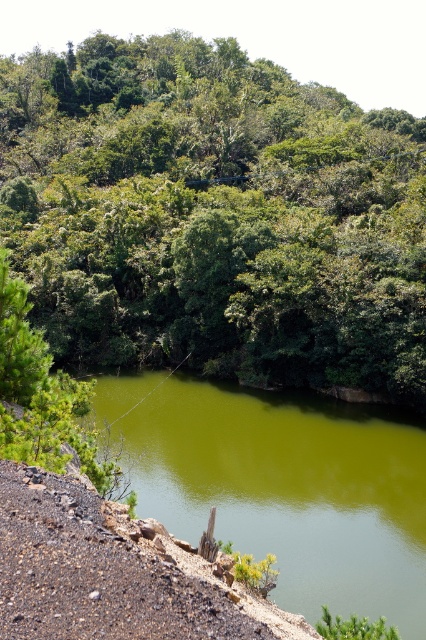
Is green leafy tree at upper center to the right of green smooth water at center from the viewer's perspective?

No, green leafy tree at upper center is not to the right of green smooth water at center.

Between green leafy tree at upper center and green smooth water at center, which one is positioned lower?

green smooth water at center is lower down.

Is point (222, 269) behind point (149, 403)?

Yes, it is behind point (149, 403).

Identify the location of green leafy tree at upper center. The width and height of the screenshot is (426, 640). (213, 216).